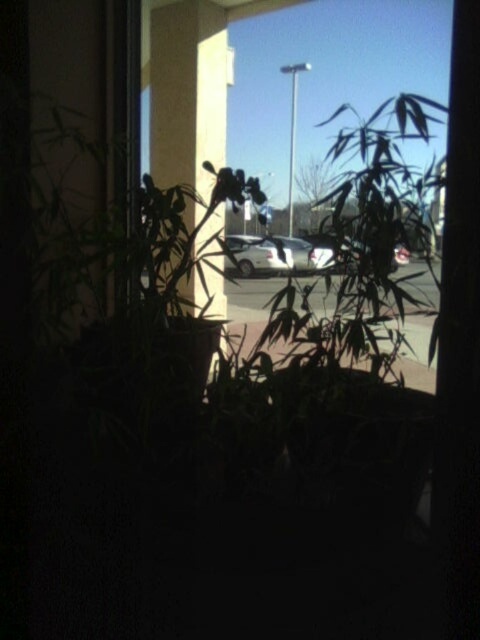
You are standing inside a building and looking through a window covered by plants. You see two cars outside in the parking lot. Which car is positioned to the left when viewed from your current vantage point inside the building? The cars are the satin silver car at center and the white matte car at center.

The satin silver car at center is positioned to the left of the white matte car at center, so the satin silver car at center is the one on the left side when viewed from inside the building.

You are a delivery person trying to park your van in the parking lot. You see two cars in the center of the image, a satin silver car at center and a white matte car at center. Which car is blocking the parking space more?

The satin silver car at center is positioned over the white matte car at center, so it is blocking the parking space more.

You are a delivery person trying to park your van between the two cars outside. The satin silver car at center and the white matte car at center are parked in the same row. Which car should you park closer to if you want to maximize the space available for your van?

You should park closer to the white matte car at center because the satin silver car at center is larger, leaving less space between them. The white matte car at center is smaller, so there will be more space available next to it for your van.